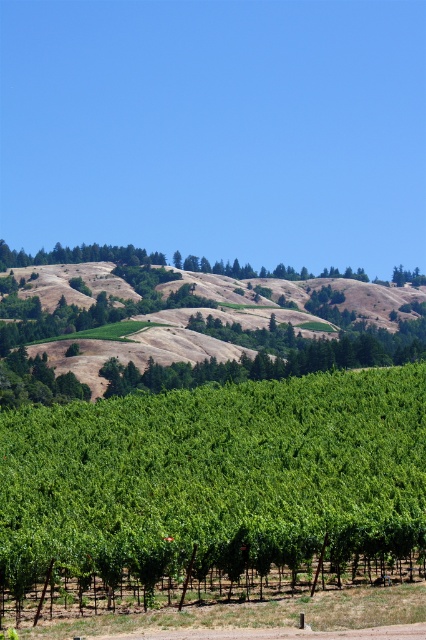
You are a hiker standing at the base of the vineyard and want to reach the top of the brown textured hillside at upper center. There are two paths available. One goes around the green leafy tree at center, and the other goes directly towards the hillside. Which path is shorter?

A: The path that goes directly towards the brown textured hillside at upper center is shorter because the green leafy tree at center is shorter than the hillside, so going around it would add extra distance.

You are a landscape architect planning to plant a new row of trees between the green leafy tree at center and the brown textured hillside at upper center. Considering their widths, which object should you place closer to the narrower area to maintain balance?

Since the green leafy tree at center is narrower than the brown textured hillside at upper center, you should place the narrower green leafy tree at center closer to the narrower area to maintain balance.

You are a hiker standing at the edge of the vineyard and you see the green leafy tree at center and the brown textured hillside at upper center. Which object is located to the left of the other?

The green leafy tree at center is positioned on the left side of brown textured hillside at upper center.